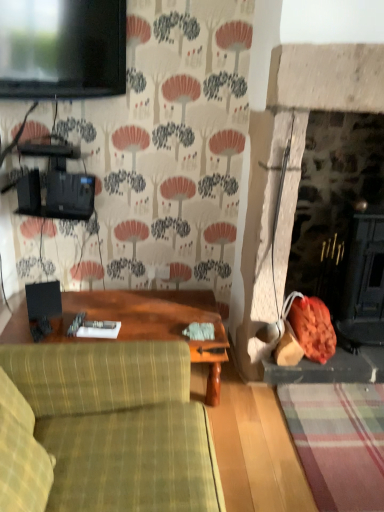
The width and height of the screenshot is (384, 512). Find the location of `free space above wooden table at center (from a real-world perspective)`. free space above wooden table at center (from a real-world perspective) is located at coordinates (109, 314).